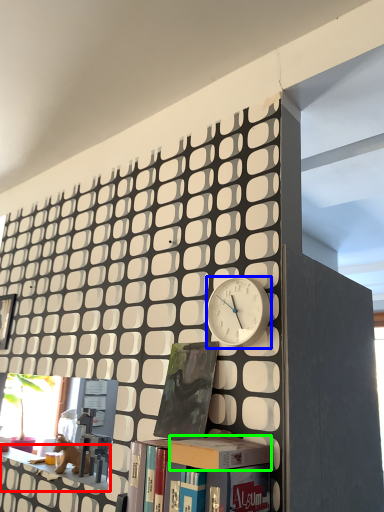
Question: Which object is the farthest from shelf (highlighted by a red box)? Choose among these: clock (highlighted by a blue box) or box (highlighted by a green box).

Choices:
 (A) clock
 (B) box

Answer: (A)